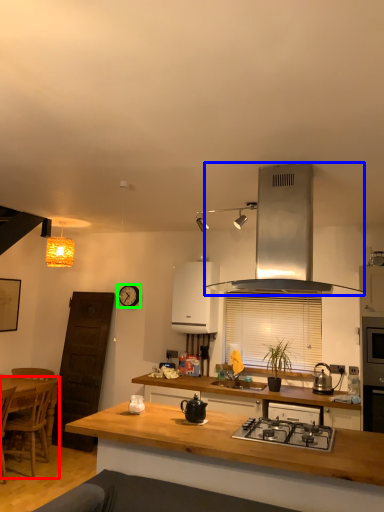
Question: Estimate the real-world distances between objects in this image. Which object is closer to chair (highlighted by a red box), kitchen appliance (highlighted by a blue box) or clock (highlighted by a green box)?

Choices:
 (A) kitchen appliance
 (B) clock

Answer: (B)